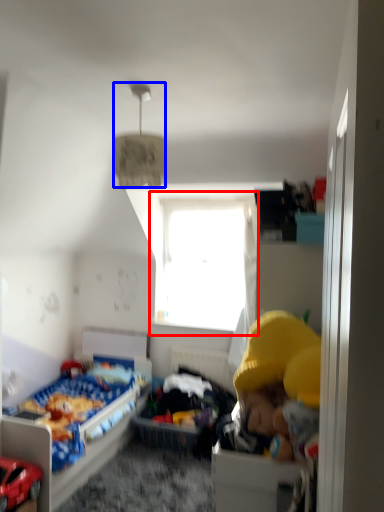
Question: Which object is closer to the camera taking this photo, window (highlighted by a red box) or lamp (highlighted by a blue box)?

Choices:
 (A) window
 (B) lamp

Answer: (B)